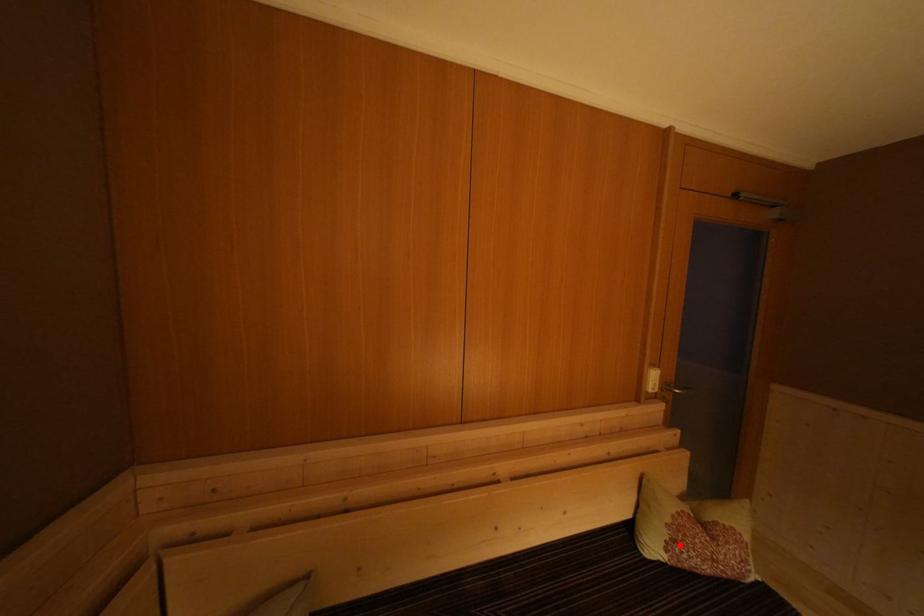
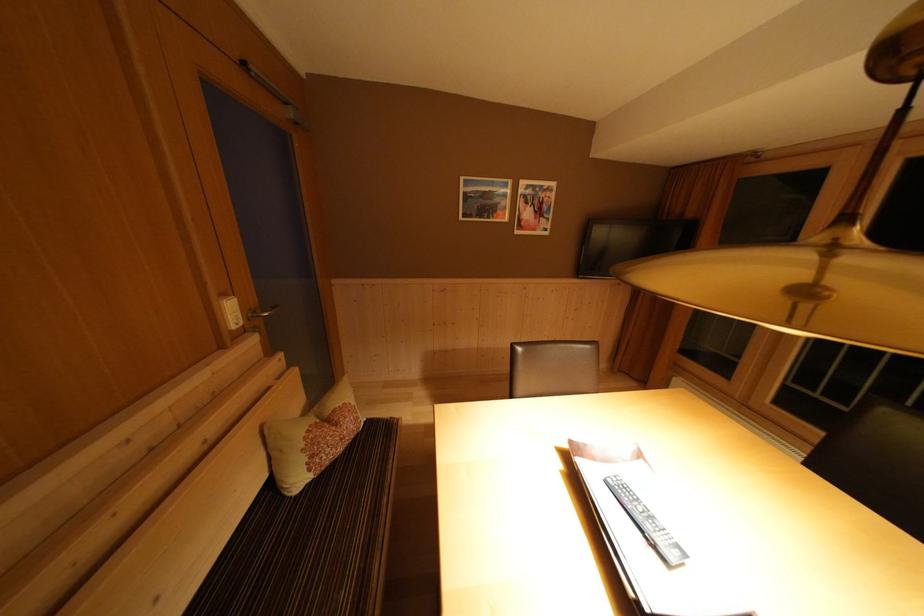
The point at the highlighted location is marked in the first image. Where is the corresponding point in the second image?

(319, 462)